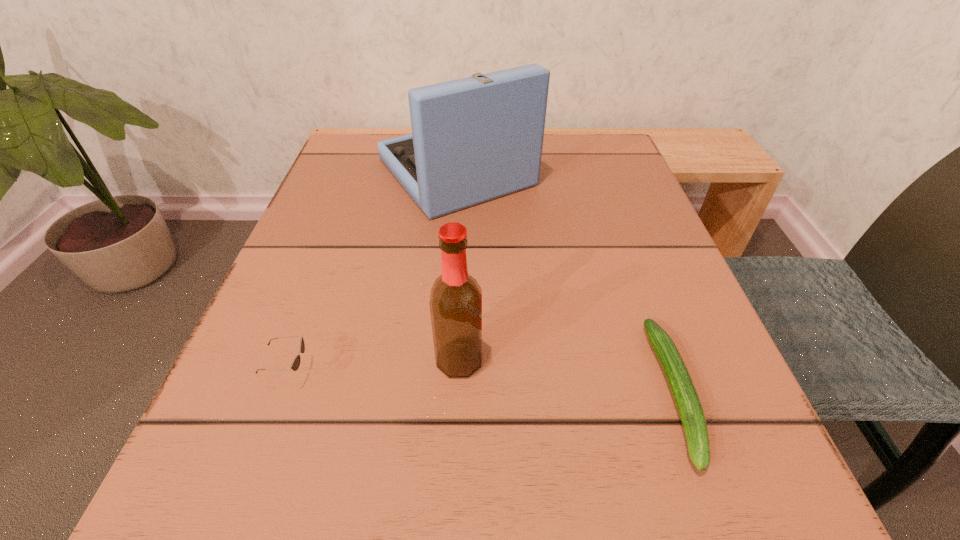
Find the location of a particular element. vacant space that satisfies the following two spatial constraints: 1. on the front side of the farthest object; 2. in front of the lenses of the second shortest object is located at coordinates (441, 373).

At what (x,y) coordinates should I click in order to perform the action: click on blank area in the image that satisfies the following two spatial constraints: 1. on the front side of the beer bottle; 2. in front of the lenses of the third tallest object. Please return your answer as a coordinate pair (x, y). The image size is (960, 540). Looking at the image, I should click on (459, 373).

At what (x,y) coordinates should I click in order to perform the action: click on blank area in the image that satisfies the following two spatial constraints: 1. on the front side of the beer bottle; 2. in front of the lenses of the sunglasses. Please return your answer as a coordinate pair (x, y). The width and height of the screenshot is (960, 540). Looking at the image, I should click on tap(459, 373).